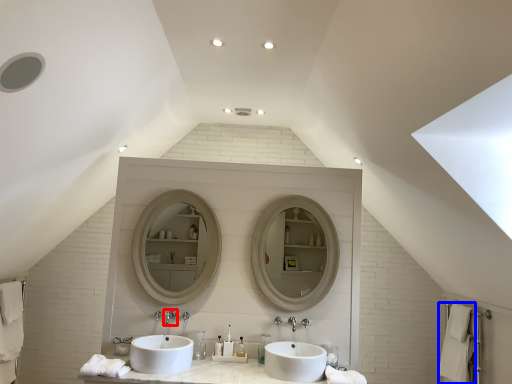
Question: Among these objects, which one is farthest to the camera, tap (highlighted by a red box) or bath towel (highlighted by a blue box)?

Choices:
 (A) tap
 (B) bath towel

Answer: (B)